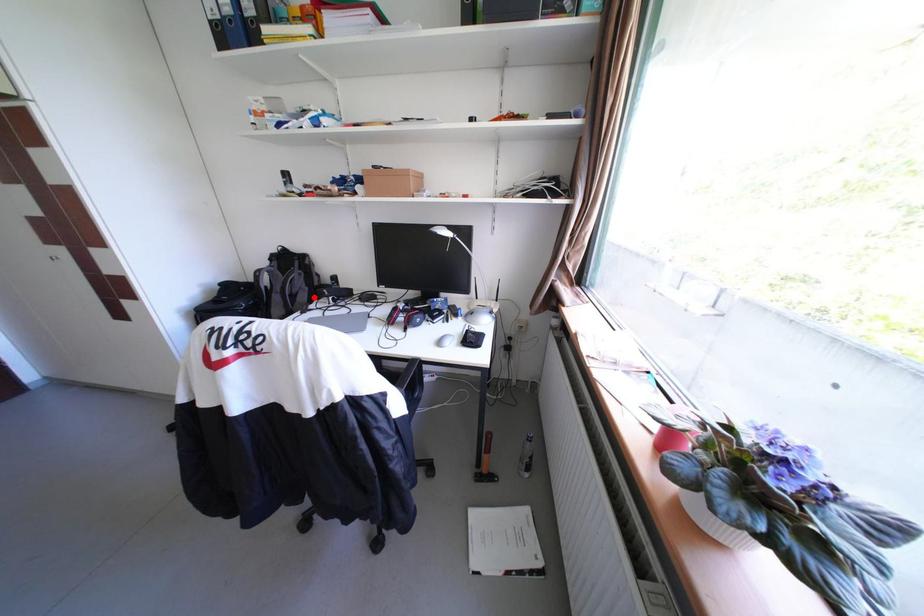
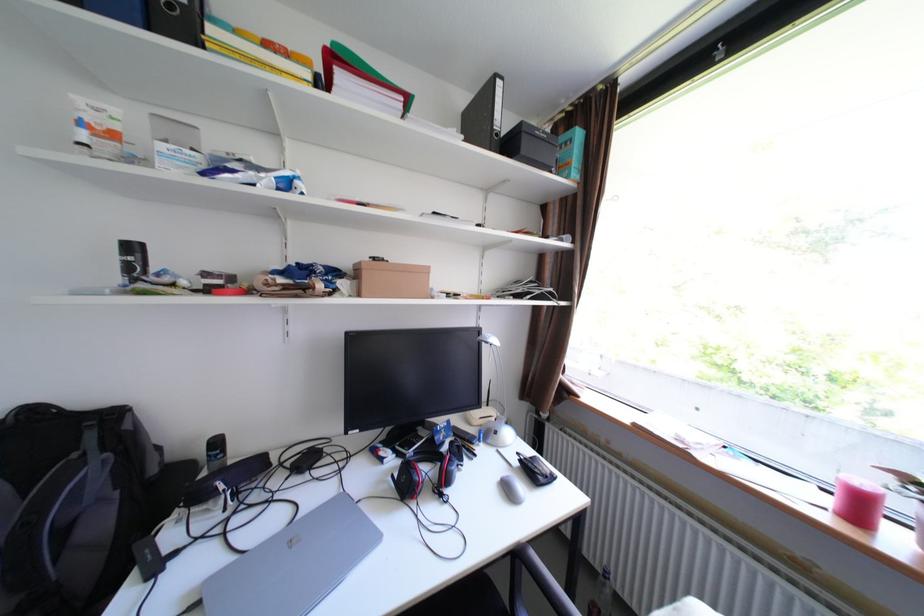
Question: I am providing you with two images of the same scene from different viewpoints. Image1 has a red point marked. In image2, the corresponding 3D location appears at what relative position? Reply with the corresponding letter.

Choices:
 (A) Closer
 (B) Farther

Answer: (A)